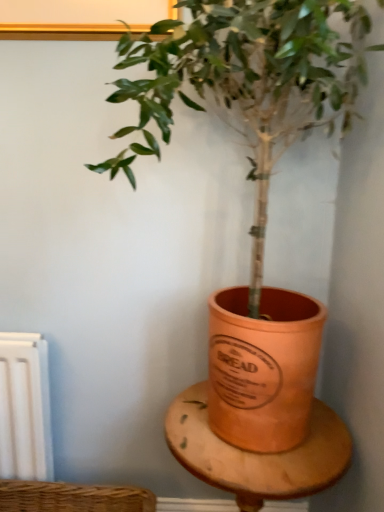
Question: From a real-world perspective, is wooden table at center over terracotta pot at center?

Choices:
 (A) no
 (B) yes

Answer: (A)

Question: Is terracotta pot at center at the back of wooden table at center?

Choices:
 (A) yes
 (B) no

Answer: (B)

Question: From a real-world perspective, is wooden table at center located beneath terracotta pot at center?

Choices:
 (A) yes
 (B) no

Answer: (A)

Question: From the image's perspective, is wooden table at center under terracotta pot at center?

Choices:
 (A) no
 (B) yes

Answer: (B)

Question: From the image's perspective, is wooden table at center located above terracotta pot at center?

Choices:
 (A) yes
 (B) no

Answer: (B)

Question: Can terracotta pot at center be found inside wooden table at center?

Choices:
 (A) yes
 (B) no

Answer: (B)

Question: Does terracotta pot at center have a greater width compared to wooden table at center?

Choices:
 (A) yes
 (B) no

Answer: (A)

Question: From a real-world perspective, is terracotta pot at center on wooden table at center?

Choices:
 (A) yes
 (B) no

Answer: (A)

Question: Is terracotta pot at center at the right side of wooden table at center?

Choices:
 (A) no
 (B) yes

Answer: (A)

Question: Can you confirm if terracotta pot at center is shorter than wooden table at center?

Choices:
 (A) yes
 (B) no

Answer: (B)

Question: Is terracotta pot at center with wooden table at center?

Choices:
 (A) yes
 (B) no

Answer: (B)

Question: Is terracotta pot at center thinner than wooden table at center?

Choices:
 (A) yes
 (B) no

Answer: (B)

Question: Looking at their shapes, would you say terracotta pot at center is wider or thinner than wooden table at center?

Choices:
 (A) wide
 (B) thin

Answer: (A)